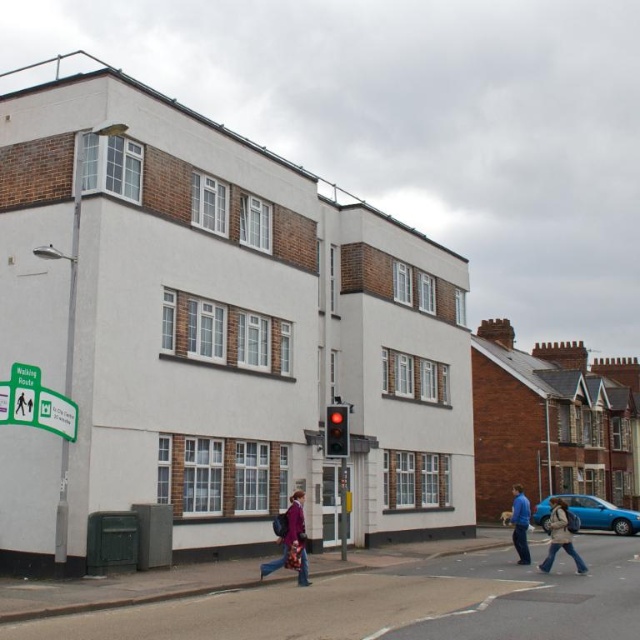
Question: Can you confirm if purple fabric coat at center is thinner than green plastic sign at lower left?

Choices:
 (A) no
 (B) yes

Answer: (A)

Question: Can you confirm if denim jacket at lower right is positioned to the left of red glass traffic light at center?

Choices:
 (A) yes
 (B) no

Answer: (B)

Question: Which is nearer to the blue cotton shirt at center?

Choices:
 (A) green plastic sign at lower left
 (B) purple fabric coat at center
 (C) denim jacket at lower right
 (D) red glass traffic light at center

Answer: (C)

Question: Which point is closer to the camera taking this photo?

Choices:
 (A) (582, 564)
 (B) (516, 552)
 (C) (330, 451)

Answer: (A)

Question: Can you confirm if purple fabric coat at center is positioned below green plastic sign at lower left?

Choices:
 (A) no
 (B) yes

Answer: (B)

Question: Which object appears closest to the camera in this image?

Choices:
 (A) blue cotton shirt at center
 (B) purple fabric coat at center

Answer: (B)